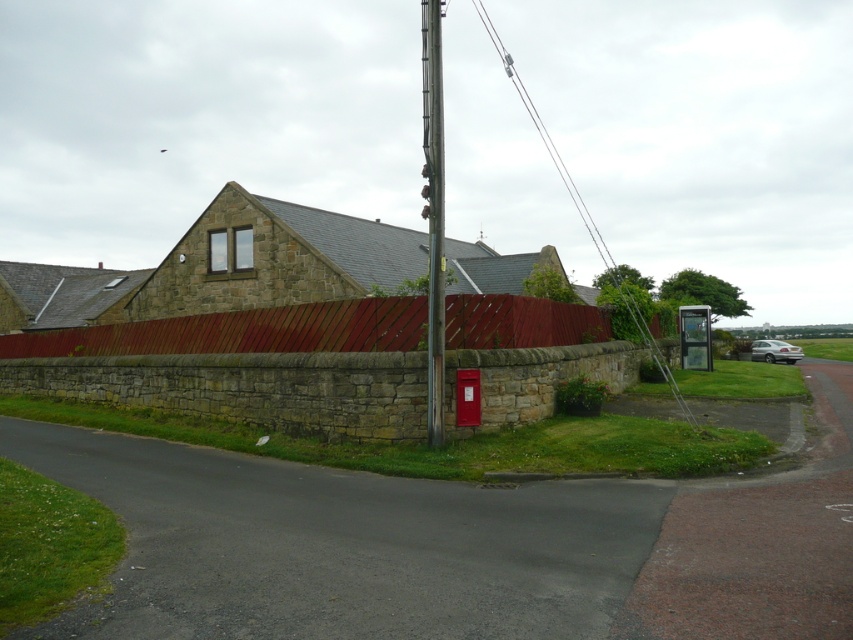
Question: Which point is farther from the camera taking this photo?

Choices:
 (A) (758, 349)
 (B) (421, 193)

Answer: (B)

Question: Which point is farther to the camera?

Choices:
 (A) silver metallic car at right
 (B) smooth metallic pole at center

Answer: (A)

Question: Does smooth metallic pole at center have a lesser width compared to silver metallic car at right?

Choices:
 (A) yes
 (B) no

Answer: (A)

Question: Can you confirm if smooth metallic pole at center is positioned to the right of silver metallic car at right?

Choices:
 (A) no
 (B) yes

Answer: (A)

Question: Can you confirm if smooth metallic pole at center is wider than silver metallic car at right?

Choices:
 (A) yes
 (B) no

Answer: (B)

Question: Among these objects, which one is farthest from the camera?

Choices:
 (A) silver metallic car at right
 (B) smooth metallic pole at center

Answer: (A)